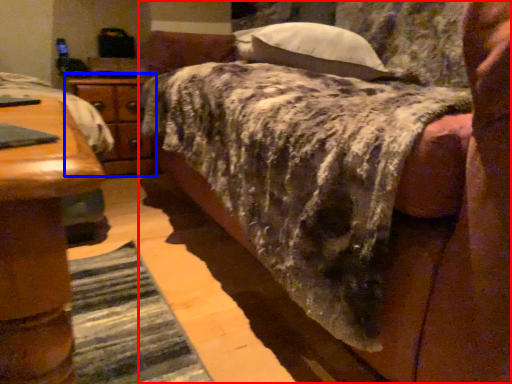
Question: Which object is closer to the camera taking this photo, bed (highlighted by a red box) or nightstand (highlighted by a blue box)?

Choices:
 (A) bed
 (B) nightstand

Answer: (A)